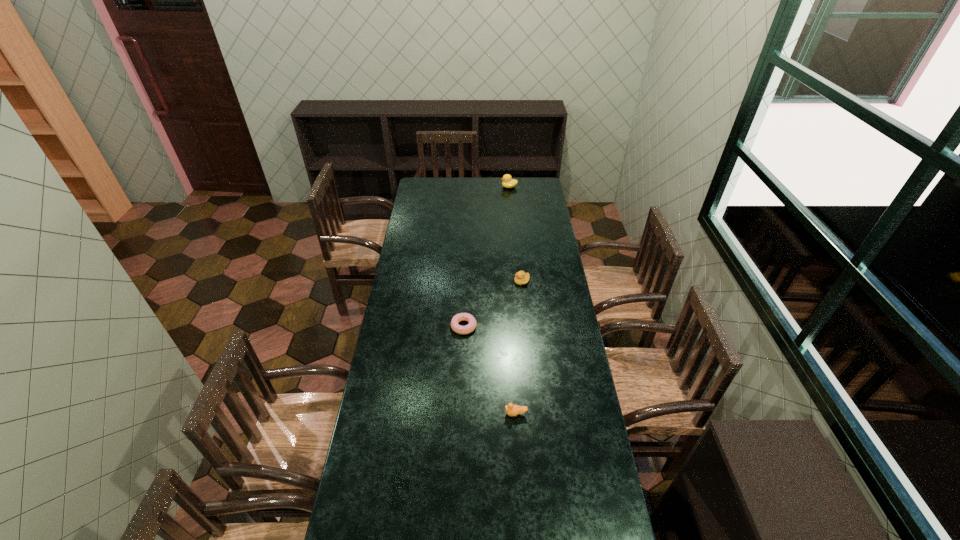
At what (x,y) coordinates should I click in order to perform the action: click on vacant space located 0.120m on the beak of the second nearest duckling. Please return your answer as a coordinate pair (x, y). Image resolution: width=960 pixels, height=540 pixels. Looking at the image, I should click on (490, 281).

In order to click on vacant space situated on the beak of the second nearest duckling in this screenshot , I will do `click(468, 281)`.

Where is `free point located 0.260m on the face of the nearest object`? This screenshot has width=960, height=540. free point located 0.260m on the face of the nearest object is located at coordinates (435, 414).

Where is `free space located on the face of the nearest object`? free space located on the face of the nearest object is located at coordinates (489, 414).

Locate an element on the screen. vacant space positioned on the face of the nearest object is located at coordinates (443, 414).

Identify the location of vacant region located on the back of the shortest object. (466, 272).

Where is `object that is positioned at the far edge`? object that is positioned at the far edge is located at coordinates (508, 182).

Image resolution: width=960 pixels, height=540 pixels. I want to click on blank space at the far edge, so click(449, 194).

Locate an element on the screen. The image size is (960, 540). vacant space at the left edge of the desktop is located at coordinates (429, 200).

Where is `vacant space at the right edge of the desktop`? The height and width of the screenshot is (540, 960). vacant space at the right edge of the desktop is located at coordinates (565, 417).